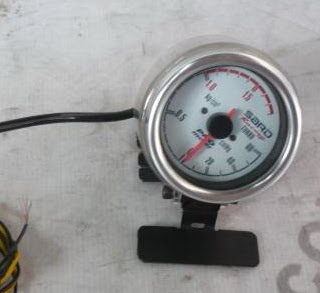
Find the location of a particular element. The height and width of the screenshot is (293, 320). wires is located at coordinates (11, 265).